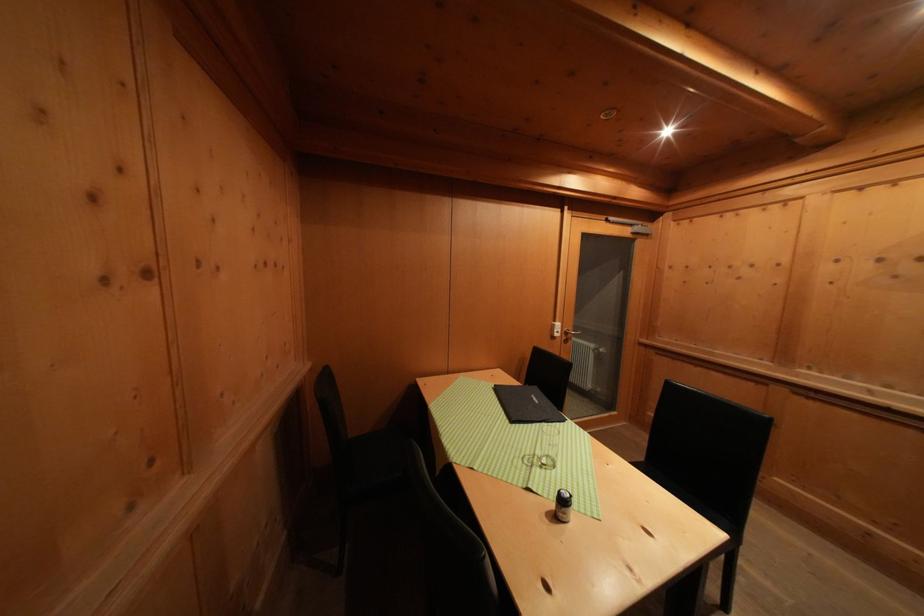
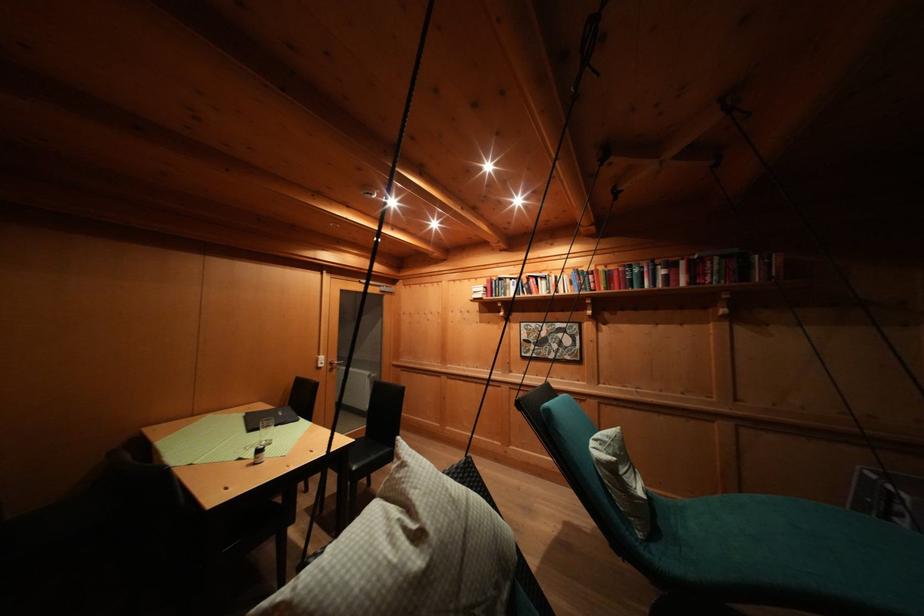
The point at [523,387] is marked in the first image. Where is the corresponding point in the second image?

(275, 411)